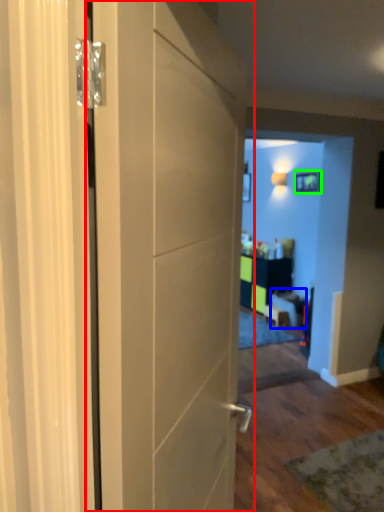
Question: Which object is the farthest from door (highlighted by a red box)? Choose among these: furniture (highlighted by a blue box) or picture frame (highlighted by a green box).

Choices:
 (A) furniture
 (B) picture frame

Answer: (B)